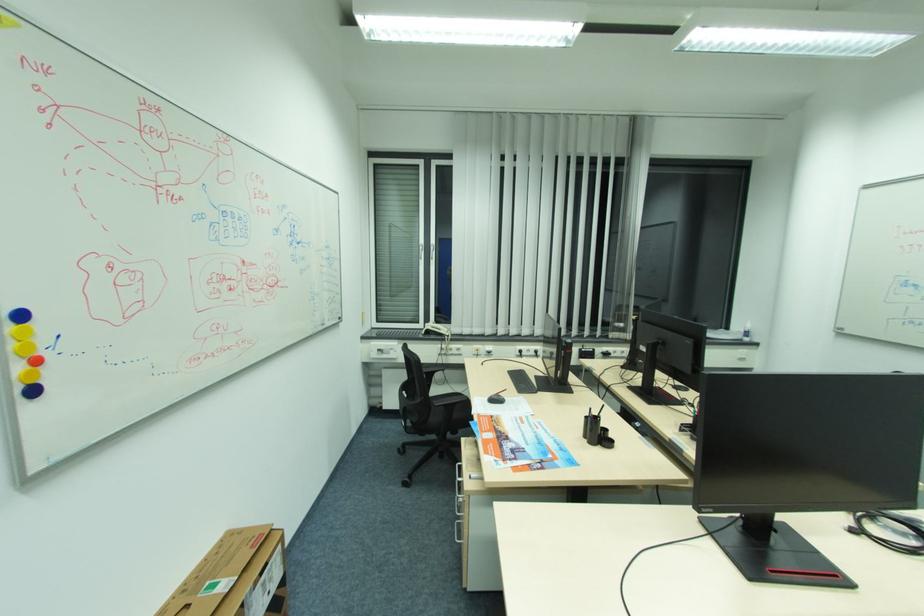
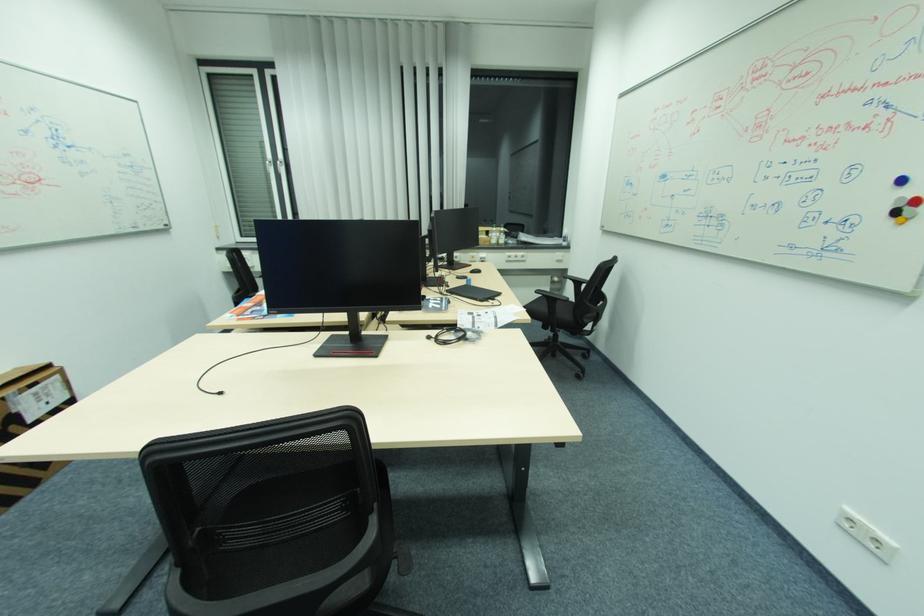
Where in the second image is the point corresponding to (718,511) from the first image?

(282, 312)